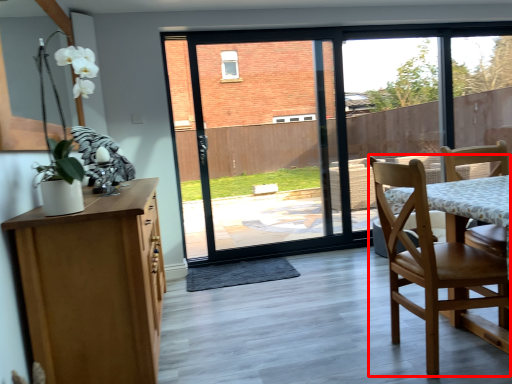
Question: From the image's perspective, where is chair (annotated by the red box) located relative to window screen?

Choices:
 (A) above
 (B) below

Answer: (B)